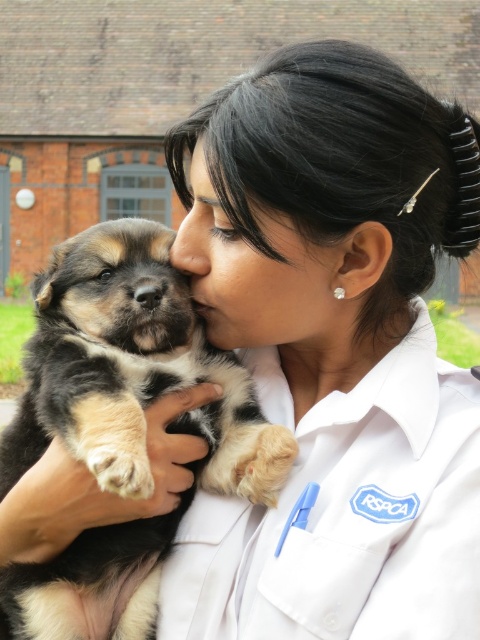
How distant is white smooth lab coat at center from soft fur puppy at center?

They are 22.42 inches apart.

Is white smooth lab coat at center positioned behind soft fur puppy at center?

Yes.

Is point (370, 481) farther from viewer compared to point (178, 310)?

That is False.

At what (x,y) coordinates should I click in order to perform the action: click on white smooth lab coat at center. Please return your answer as a coordinate pair (x, y). Image resolution: width=480 pixels, height=640 pixels. Looking at the image, I should click on (346, 515).